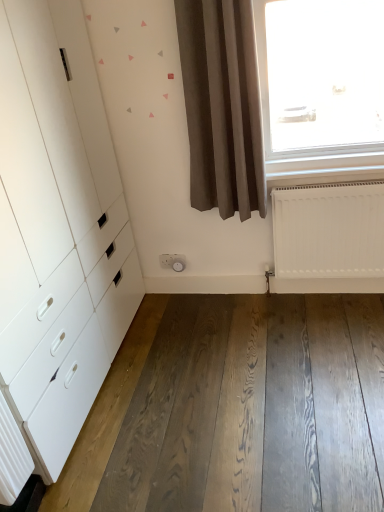
Question: Based on their positions, is white plastic socket at center located to the left or right of white matte chest of drawers at left?

Choices:
 (A) right
 (B) left

Answer: (A)

Question: Which is correct: white plastic socket at center is inside white matte chest of drawers at left, or outside of it?

Choices:
 (A) outside
 (B) inside

Answer: (A)

Question: Considering the real-world distances, which object is farthest from the white plastic socket at center?

Choices:
 (A) brown matte curtain at center
 (B) white matte chest of drawers at left
 (C) white matte radiator at lower right
 (D) dark brown wood flooring at lower center

Answer: (D)

Question: Which object is the farthest from the white plastic socket at center?

Choices:
 (A) white matte chest of drawers at left
 (B) dark brown wood flooring at lower center
 (C) white matte radiator at lower right
 (D) brown matte curtain at center

Answer: (B)